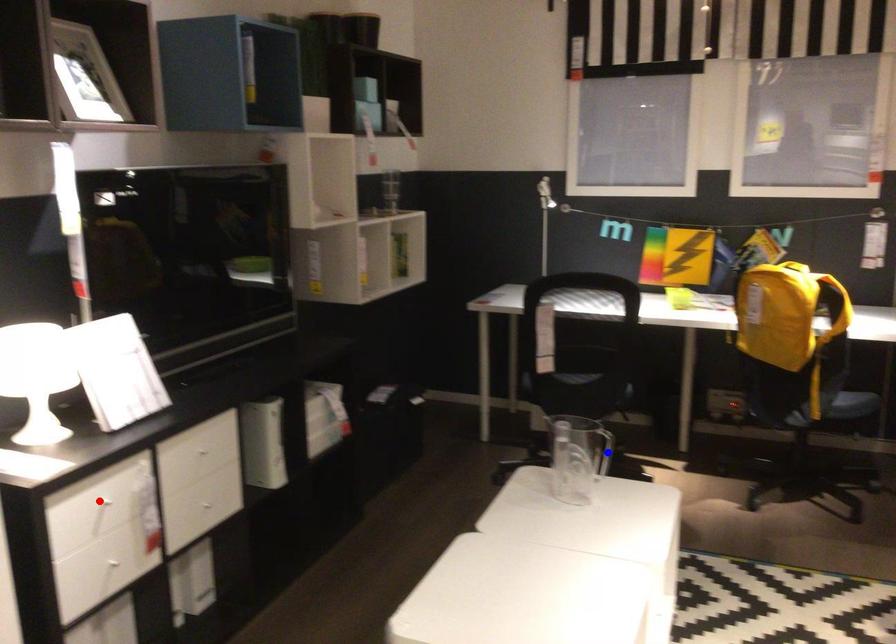
Question: Which of the two points in the image is closer to the camera?

Choices:
 (A) Blue point is closer.
 (B) Red point is closer.

Answer: (B)